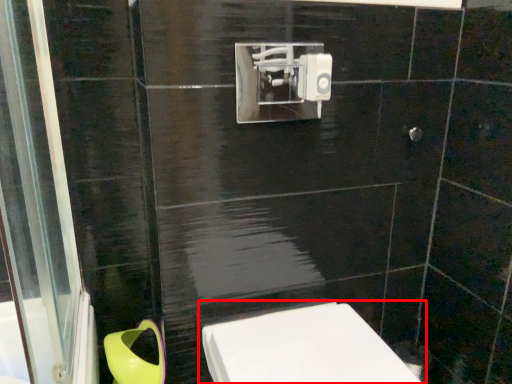
Question: From the image's perspective, where is toilet (annotated by the red box) located relative to toilet bowl?

Choices:
 (A) below
 (B) above

Answer: (B)